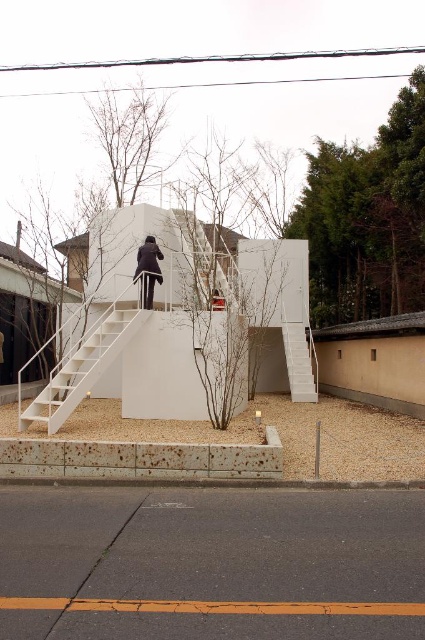
You are standing at the base of the stairs leading to the modern building. You see two points marked on the structure. The first point is at coordinates point (129, 317) and the second is at point (224, 285). Which point would appear larger in your view?

Point (129, 317) is closer to the camera than point (224, 285), so it would appear larger in your view.

You are a delivery person trying to reach the front door of the building. You see the white matte staircase at center and the black matte jacket at center. Which object is closer to the ground?

The black matte jacket at center is closer to the ground because the white matte staircase at center is taller than it.

You are standing on the paved road in front of the modern building. You see the white matte staircase at center and the black matte jacket at center. Which object is closer to your right side?

The black matte jacket at center is closer to your right side because the white matte staircase at center is to the left of it.